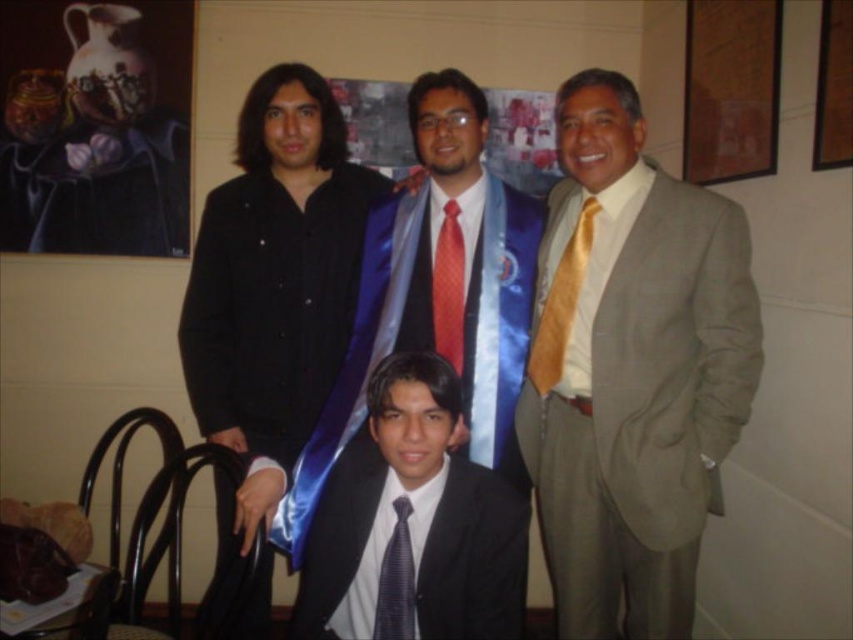
Is black satin jacket at upper left bigger than shiny blue sash at center?

Yes, black satin jacket at upper left is bigger than shiny blue sash at center.

This screenshot has width=853, height=640. Find the location of `black satin jacket at upper left`. black satin jacket at upper left is located at coordinates (276, 269).

In the scene shown: Between black satin suit at lower center and matte gold tie at right, which one appears on the left side from the viewer's perspective?

black satin suit at lower center is more to the left.

Between point (486, 627) and point (566, 260), which one is positioned in front?

Point (486, 627) is in front.

Where is `black satin suit at lower center`? The width and height of the screenshot is (853, 640). black satin suit at lower center is located at coordinates (474, 557).

Is the position of black satin jacket at upper left more distant than that of matte gold tie at right?

Yes, black satin jacket at upper left is behind matte gold tie at right.

Between point (218, 474) and point (578, 259), which one is positioned in front?

Point (578, 259)

In order to click on black satin jacket at upper left in this screenshot , I will do `click(276, 269)`.